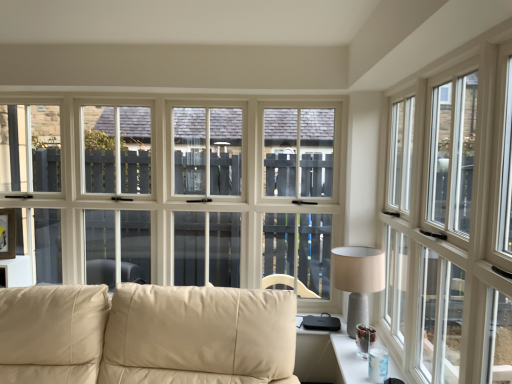
Question: From a real-world perspective, is clear glass table at lower right over beige fabric lampshade at right?

Choices:
 (A) yes
 (B) no

Answer: (B)

Question: Does clear glass table at lower right lie in front of beige fabric lampshade at right?

Choices:
 (A) yes
 (B) no

Answer: (A)

Question: Is clear glass table at lower right further to camera compared to beige fabric lampshade at right?

Choices:
 (A) no
 (B) yes

Answer: (A)

Question: Can you confirm if clear glass table at lower right is bigger than beige fabric lampshade at right?

Choices:
 (A) no
 (B) yes

Answer: (A)

Question: Is beige fabric lampshade at right completely or partially inside clear glass table at lower right?

Choices:
 (A) no
 (B) yes

Answer: (A)

Question: Does clear glass table at lower right have a greater width compared to beige fabric lampshade at right?

Choices:
 (A) no
 (B) yes

Answer: (A)

Question: Considering the relative sizes of clear glass table at lower right and white glossy window at right in the image provided, is clear glass table at lower right smaller than white glossy window at right?

Choices:
 (A) no
 (B) yes

Answer: (B)

Question: Considering the relative sizes of clear glass table at lower right and white glossy window at right in the image provided, is clear glass table at lower right bigger than white glossy window at right?

Choices:
 (A) yes
 (B) no

Answer: (B)

Question: Is clear glass table at lower right positioned far away from white glossy window at right?

Choices:
 (A) no
 (B) yes

Answer: (A)

Question: From a real-world perspective, is clear glass table at lower right located beneath white glossy window at right?

Choices:
 (A) yes
 (B) no

Answer: (A)

Question: From a real-world perspective, is clear glass table at lower right over white glossy window at right?

Choices:
 (A) no
 (B) yes

Answer: (A)

Question: Does clear glass table at lower right have a lesser width compared to white glossy window at right?

Choices:
 (A) no
 (B) yes

Answer: (A)

Question: Is beige leather couch at lower left wider than white glossy window at right?

Choices:
 (A) no
 (B) yes

Answer: (B)